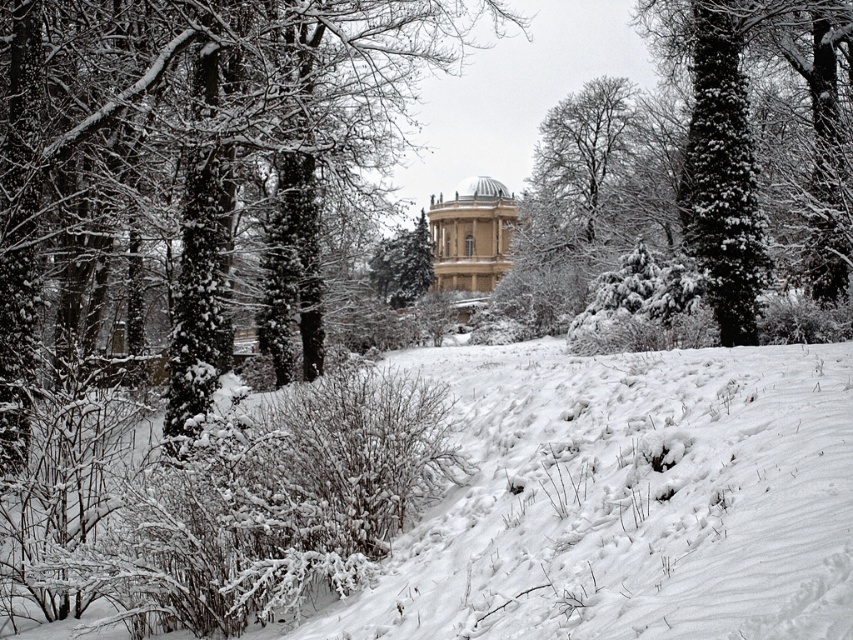
The image size is (853, 640). What do you see at coordinates (192, 172) in the screenshot? I see `snow-covered tree at center` at bounding box center [192, 172].

Consider the image. Is snow-covered tree at center smaller than white marble gazebo at center?

No, snow-covered tree at center is not smaller than white marble gazebo at center.

What do you see at coordinates (192, 172) in the screenshot? Image resolution: width=853 pixels, height=640 pixels. I see `snow-covered tree at center` at bounding box center [192, 172].

At what (x,y) coordinates should I click in order to perform the action: click on snow-covered tree at center. Please return your answer as a coordinate pair (x, y). The image size is (853, 640). Looking at the image, I should click on (192, 172).

Does white fluffy snow at center lie behind white marble gazebo at center?

No.

Identify the location of white fluffy snow at center. This screenshot has height=640, width=853. (627, 499).

Image resolution: width=853 pixels, height=640 pixels. Identify the location of white fluffy snow at center. (627, 499).

Which is in front, point (270, 61) or point (328, 628)?

Point (328, 628)

Between snow-covered tree at center and white fluffy snow at center, which one appears on the left side from the viewer's perspective?

snow-covered tree at center is more to the left.

Is point (27, 180) more distant than point (724, 625)?

Yes, it is behind point (724, 625).

Image resolution: width=853 pixels, height=640 pixels. Identify the location of snow-covered tree at center. (192, 172).